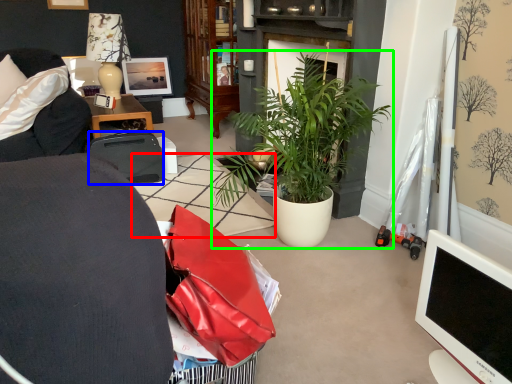
Question: Which object is the closest to the tile (highlighted by a red box)? Choose among these: luggage and bags (highlighted by a blue box) or houseplant (highlighted by a green box).

Choices:
 (A) luggage and bags
 (B) houseplant

Answer: (A)